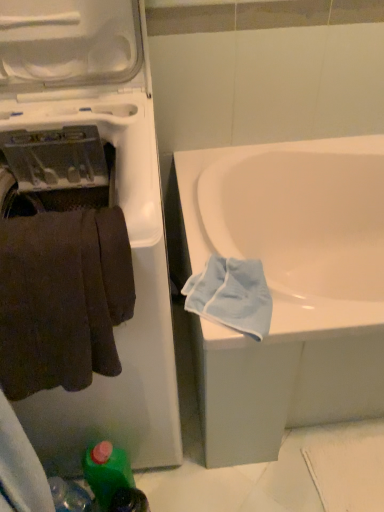
Question: Relative to green plastic bottle at lower left, is white plastic washing machine at left in front or behind?

Choices:
 (A) behind
 (B) front

Answer: (B)

Question: Is white plastic washing machine at left bigger or smaller than green plastic bottle at lower left?

Choices:
 (A) small
 (B) big

Answer: (B)

Question: Which is nearer to the light blue cotton towel at lower right?

Choices:
 (A) green plastic bottle at lower left
 (B) dark brown fabric towel at left
 (C) white glossy bathtub at center
 (D) white plastic washing machine at left

Answer: (B)

Question: Which object is the farthest from the white plastic washing machine at left?

Choices:
 (A) green plastic bottle at lower left
 (B) dark brown fabric towel at left
 (C) white glossy bathtub at center
 (D) light blue cotton towel at lower right

Answer: (C)